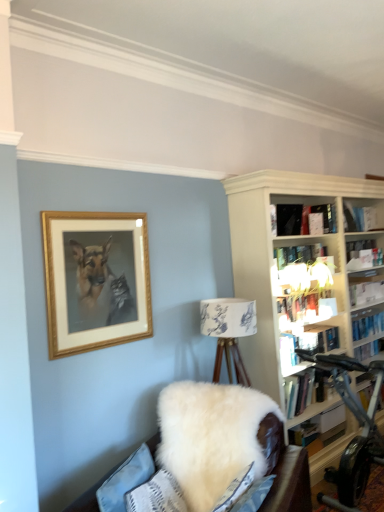
Question: In the image, is white fluffy couch at lower center on the left side or the right side of hardcover book at center-right, which is the second book from bottom to top?

Choices:
 (A) right
 (B) left

Answer: (B)

Question: Considering the positions of white fluffy couch at lower center and hardcover book at center-right, which is counted as the fifth book, starting from the top, in the image, is white fluffy couch at lower center taller or shorter than hardcover book at center-right, which is counted as the fifth book, starting from the top,?

Choices:
 (A) tall
 (B) short

Answer: (A)

Question: Which object is positioned closest to the silver metallic stationary bicycle at right?

Choices:
 (A) white fluffy couch at lower center
 (B) black matte book at upper center, which is the first book in top-to-bottom order
 (C) hardcover book at upper right, the second book from the top
 (D) wooden picture frame at upper left
 (E) hardcover book at lower right, positioned as the first book in bottom-to-top order

Answer: (E)

Question: Which is farther from the black matte book at upper center, which is the first book in top-to-bottom order?

Choices:
 (A) hardcover book at center-right, which is the second book from bottom to top
 (B) hardcover book at upper right, marked as the fourth book in a top-to-bottom arrangement
 (C) hardcover book at upper right, the second book from the top
 (D) white fluffy couch at lower center
 (E) wooden picture frame at upper left

Answer: (D)